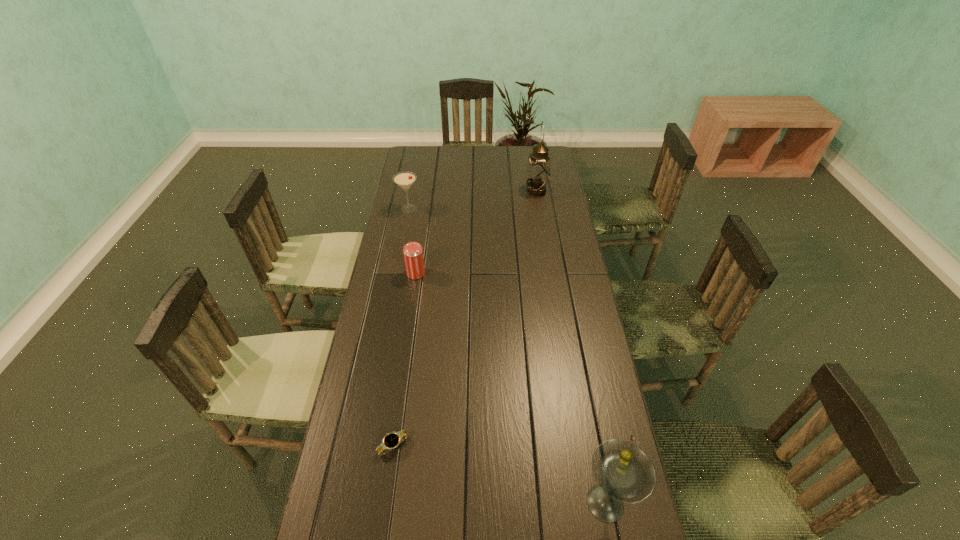
You are a GUI agent. You are given a task and a screenshot of the screen. Output one action in this format:
    pyautogui.click(x=<x>, y=<y>)
    Task: Click on the farthest object
    The height and width of the screenshot is (540, 960).
    Given the screenshot: What is the action you would take?
    pyautogui.click(x=538, y=169)

Find the location of `oil lamp`. oil lamp is located at coordinates (538, 169).

The width and height of the screenshot is (960, 540). In order to click on the nearest object in this screenshot , I will do `click(624, 473)`.

Locate an element on the screen. This screenshot has width=960, height=540. the right martini is located at coordinates (624, 473).

You are a GUI agent. You are given a task and a screenshot of the screen. Output one action in this format:
    pyautogui.click(x=<x>, y=<y>)
    Task: Click on the farther martini
    The image size is (960, 540).
    Given the screenshot: What is the action you would take?
    pyautogui.click(x=405, y=179)

Where is `the shorter martini`? the shorter martini is located at coordinates pyautogui.click(x=405, y=179).

Find the location of a particular element. The width and height of the screenshot is (960, 540). the third farthest object is located at coordinates (413, 252).

The image size is (960, 540). Identify the location of the fourth tallest object. (413, 252).

Locate an element on the screen. This screenshot has height=540, width=960. the shortest object is located at coordinates click(392, 440).

In order to click on watch in this screenshot , I will do `click(392, 440)`.